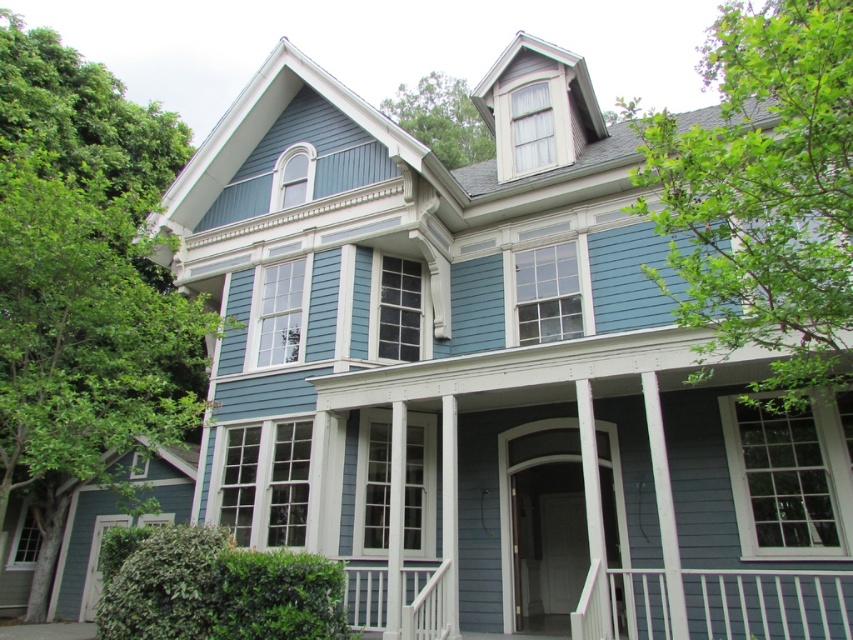
Question: Is green leafy tree at upper right thinner than green leafy tree at upper center?

Choices:
 (A) no
 (B) yes

Answer: (A)

Question: Can you confirm if green leafy tree at upper right is positioned to the right of green leafy tree at upper center?

Choices:
 (A) no
 (B) yes

Answer: (B)

Question: Which of the following is the closest to the observer?

Choices:
 (A) (115, 328)
 (B) (492, 148)
 (C) (369, 592)
 (D) (743, 259)

Answer: (D)

Question: Among these objects, which one is nearest to the camera?

Choices:
 (A) green leafy tree at upper right
 (B) green leafy tree at upper center

Answer: (A)

Question: Which object is closer to the camera taking this photo?

Choices:
 (A) green leafy tree at upper right
 (B) green leafy tree at left

Answer: (A)

Question: Is green leafy tree at left further to the viewer compared to green leafy tree at upper center?

Choices:
 (A) yes
 (B) no

Answer: (B)